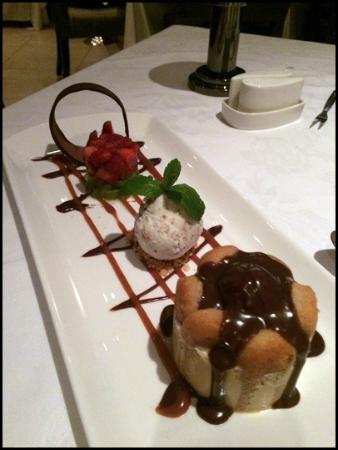
The height and width of the screenshot is (450, 338). I want to click on countertop, so click(38, 365), click(309, 227).